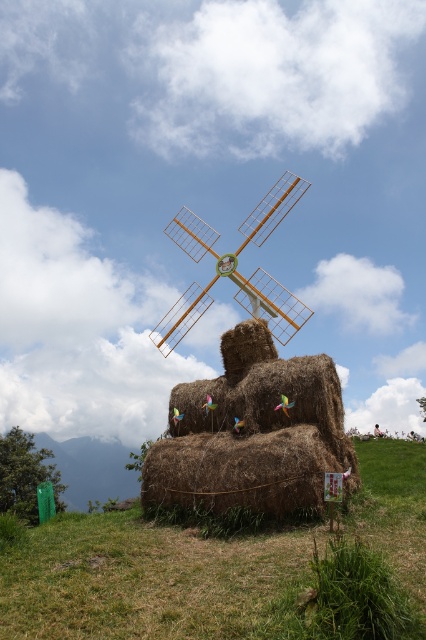
Question: In this image, where is brown grassy at center located relative to wooden windmill at center?

Choices:
 (A) below
 (B) above

Answer: (A)

Question: Which point appears farthest from the camera in this image?

Choices:
 (A) (195, 256)
 (B) (78, 582)

Answer: (A)

Question: Is brown grassy at center below wooden windmill at center?

Choices:
 (A) no
 (B) yes

Answer: (B)

Question: Is brown grassy at center further to camera compared to wooden windmill at center?

Choices:
 (A) yes
 (B) no

Answer: (B)